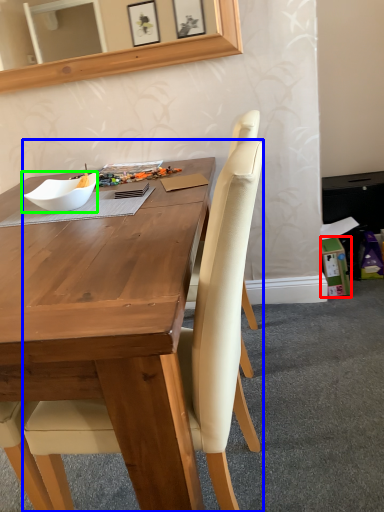
Question: Which object is the closest to the box (highlighted by a red box)? Choose among these: chair (highlighted by a blue box) or bowl (highlighted by a green box).

Choices:
 (A) chair
 (B) bowl

Answer: (B)